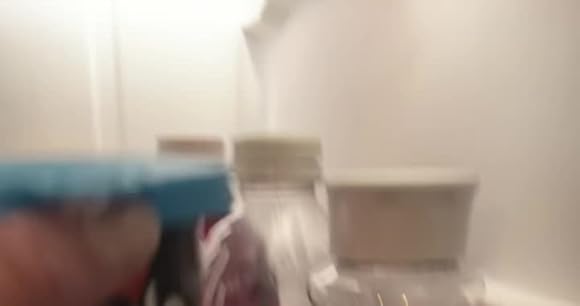
This screenshot has width=580, height=306. Identify the location of white wall. (65, 56).